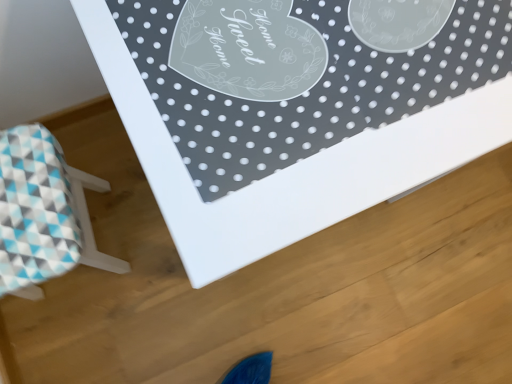
Image resolution: width=512 pixels, height=384 pixels. I want to click on blue checkered stool at lower left, so click(44, 213).

What do you see at coordinates (44, 213) in the screenshot? This screenshot has height=384, width=512. I see `blue checkered stool at lower left` at bounding box center [44, 213].

In the scene shown: What is the approximate width of white glossy table at upper center?

white glossy table at upper center is 23.60 inches in width.

Find the location of a particular element. white glossy table at upper center is located at coordinates (297, 108).

Describe the element at coordinates (297, 108) in the screenshot. I see `white glossy table at upper center` at that location.

Where is `blue checkered stool at lower left`? This screenshot has width=512, height=384. blue checkered stool at lower left is located at coordinates (44, 213).

Can you confirm if blue checkered stool at lower left is positioned to the left of white glossy table at upper center?

Yes.

Considering the positions of objects blue checkered stool at lower left and white glossy table at upper center in the image provided, who is behind, blue checkered stool at lower left or white glossy table at upper center?

blue checkered stool at lower left is further away from the camera.

Which is less distant, [23,294] or [348,131]?

Positioned in front is point [348,131].

From the image's perspective, which one is positioned higher, blue checkered stool at lower left or white glossy table at upper center?

white glossy table at upper center.

From a real-world perspective, is blue checkered stool at lower left positioned under white glossy table at upper center based on gravity?

Yes, from a real-world perspective, blue checkered stool at lower left is under white glossy table at upper center.

Does blue checkered stool at lower left have a lesser width compared to white glossy table at upper center?

Yes.

Considering the sizes of blue checkered stool at lower left and white glossy table at upper center in the image, is blue checkered stool at lower left taller or shorter than white glossy table at upper center?

Clearly, blue checkered stool at lower left is shorter compared to white glossy table at upper center.

From the picture: Considering the relative sizes of blue checkered stool at lower left and white glossy table at upper center in the image provided, is blue checkered stool at lower left smaller than white glossy table at upper center?

Indeed, blue checkered stool at lower left has a smaller size compared to white glossy table at upper center.

Is blue checkered stool at lower left located outside white glossy table at upper center?

blue checkered stool at lower left lies outside white glossy table at upper center's area.

Is blue checkered stool at lower left in contact with white glossy table at upper center?

No, blue checkered stool at lower left is not with white glossy table at upper center.

Does blue checkered stool at lower left turn towards white glossy table at upper center?

Yes.

Find the location of a particular element. The image size is (512, 384). furniture that is under the white glossy table at upper center (from a real-world perspective) is located at coordinates (44, 213).

Does white glossy table at upper center appear on the left side of blue checkered stool at lower left?

Incorrect, white glossy table at upper center is not on the left side of blue checkered stool at lower left.

Which is in front, white glossy table at upper center or blue checkered stool at lower left?

white glossy table at upper center.

Is point (106, 13) in front of point (11, 280)?

Yes, it is.

From the image's perspective, which is below, white glossy table at upper center or blue checkered stool at lower left?

blue checkered stool at lower left is shown below in the image.

From a real-world perspective, which object stands above the other?

In real-world perspective, white glossy table at upper center is above.

Which of these two, white glossy table at upper center or blue checkered stool at lower left, is wider?

Wider between the two is white glossy table at upper center.

Is white glossy table at upper center taller or shorter than blue checkered stool at lower left?

white glossy table at upper center is taller than blue checkered stool at lower left.

Is white glossy table at upper center smaller than blue checkered stool at lower left?

No.

Is white glossy table at upper center situated inside blue checkered stool at lower left or outside?

white glossy table at upper center cannot be found inside blue checkered stool at lower left.

Is the surface of white glossy table at upper center in direct contact with blue checkered stool at lower left?

No.

Could you tell me if white glossy table at upper center is facing blue checkered stool at lower left?

No, white glossy table at upper center is not aimed at blue checkered stool at lower left.

How many degrees apart are the facing directions of white glossy table at upper center and blue checkered stool at lower left?

There is a 83.3-degree angle between the facing directions of white glossy table at upper center and blue checkered stool at lower left.

Measure the distance from white glossy table at upper center to blue checkered stool at lower left.

white glossy table at upper center and blue checkered stool at lower left are 20.44 inches apart.

The image size is (512, 384). Find the location of `table lying on the right of blue checkered stool at lower left`. table lying on the right of blue checkered stool at lower left is located at coordinates (297, 108).

The image size is (512, 384). What are the coordinates of `table above the blue checkered stool at lower left (from a real-world perspective)` in the screenshot? It's located at (297, 108).

At what (x,y) coordinates should I click in order to perform the action: click on table above the blue checkered stool at lower left (from the image's perspective). Please return your answer as a coordinate pair (x, y). Image resolution: width=512 pixels, height=384 pixels. Looking at the image, I should click on (297, 108).